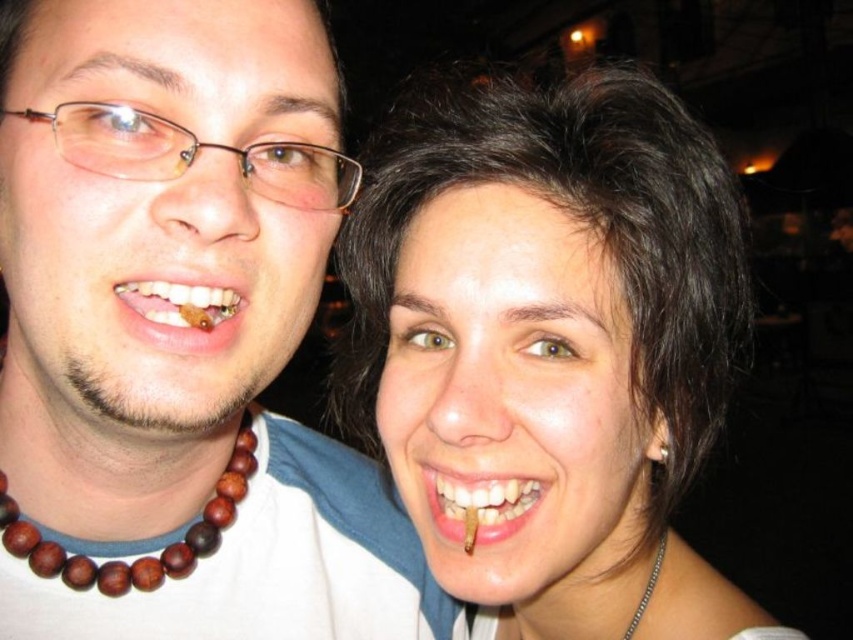
You are a photographer adjusting the lighting in this scene. You notice the brown wooden beads at left and the teeth with brown stain at lower center. Which object should you focus your spotlight on to ensure it stands out more due to its height?

The brown wooden beads at left should be focused on because it is much taller than the teeth with brown stain at lower center.